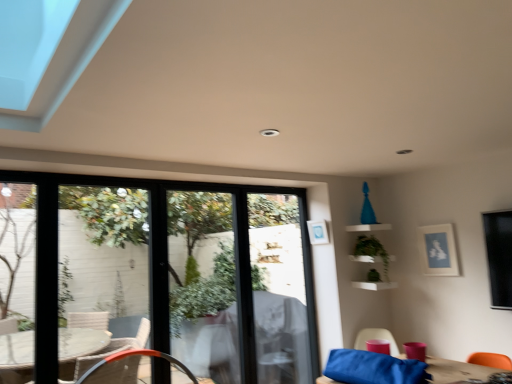
Question: Is green matte plant at upper right positioned in front of matte pink cup at lower right, the 2th chair from the left?

Choices:
 (A) yes
 (B) no

Answer: (B)

Question: From a real-world perspective, is green matte plant at upper right under matte pink cup at lower right, which is the first chair in right-to-left order?

Choices:
 (A) yes
 (B) no

Answer: (B)

Question: Considering the relative sizes of green matte plant at upper right and matte pink cup at lower right, the 2th chair from the left, in the image provided, is green matte plant at upper right thinner than matte pink cup at lower right, the 2th chair from the left,?

Choices:
 (A) no
 (B) yes

Answer: (A)

Question: Can you confirm if green matte plant at upper right is positioned to the right of matte pink cup at lower right, the 2th chair from the left?

Choices:
 (A) yes
 (B) no

Answer: (A)

Question: Is green matte plant at upper right oriented towards matte pink cup at lower right, which is the first chair in right-to-left order?

Choices:
 (A) no
 (B) yes

Answer: (A)

Question: From the image's perspective, is green matte plant at upper right beneath matte pink cup at lower right, which is the first chair in right-to-left order?

Choices:
 (A) no
 (B) yes

Answer: (A)

Question: Is transparent glass window at center at the right side of green matte plant at upper right?

Choices:
 (A) no
 (B) yes

Answer: (A)

Question: Does transparent glass window at center have a larger size compared to green matte plant at upper right?

Choices:
 (A) no
 (B) yes

Answer: (B)

Question: Is green matte plant at upper right completely or partially inside transparent glass window at center?

Choices:
 (A) yes
 (B) no

Answer: (B)

Question: Is transparent glass window at center not close to green matte plant at upper right?

Choices:
 (A) no
 (B) yes

Answer: (B)

Question: Does transparent glass window at center come in front of green matte plant at upper right?

Choices:
 (A) yes
 (B) no

Answer: (A)

Question: Is transparent glass window at center taller than green matte plant at upper right?

Choices:
 (A) no
 (B) yes

Answer: (B)

Question: Is white wicker chair at lower left, acting as the first chair starting from the left, positioned behind matte blue picture frame at upper right, the second picture frame positioned from the left?

Choices:
 (A) no
 (B) yes

Answer: (A)